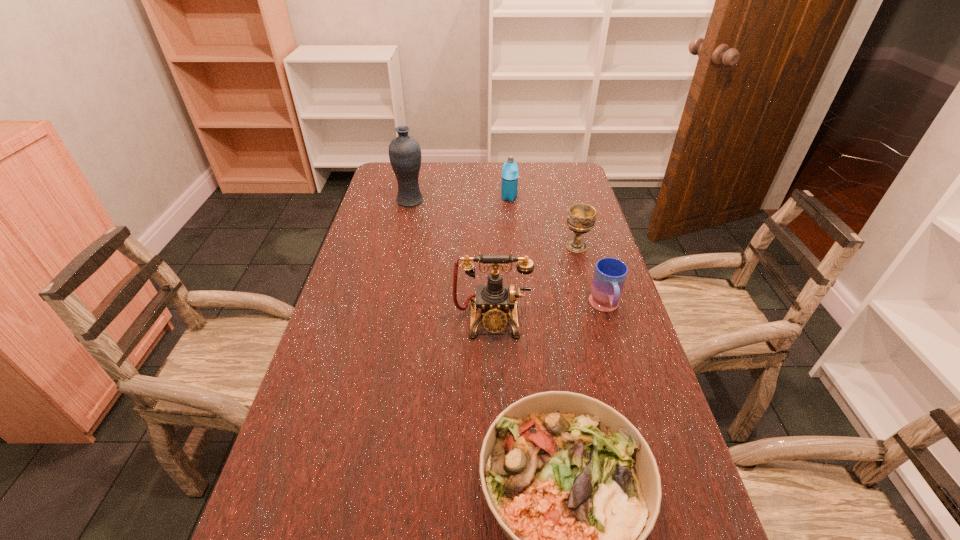
What are the coordinates of `vase` in the screenshot? It's located at (404, 151).

Locate an element on the screen. The image size is (960, 540). the tallest object is located at coordinates (404, 151).

Identify the location of the fifth shortest object. (494, 299).

Where is `thermos bottle`? Image resolution: width=960 pixels, height=540 pixels. thermos bottle is located at coordinates coord(509,185).

You are a GUI agent. You are given a task and a screenshot of the screen. Output one action in this format:
    pyautogui.click(x=<x>, y=<y>)
    Task: Click on the fourth nearest object
    The image size is (960, 540).
    Given the screenshot: What is the action you would take?
    pyautogui.click(x=581, y=218)

The image size is (960, 540). Identify the location of mug. (610, 274).

Identify the location of free region located 0.090m on the left of the vase. (371, 201).

Locate an element on the screen. vacant space located on the front of the fifth shortest object, featuring the rotary dial is located at coordinates (494, 422).

This screenshot has width=960, height=540. I want to click on free region located on the left of the thermos bottle, so click(422, 198).

This screenshot has width=960, height=540. I want to click on blank space located 0.300m on the left of the chalice, so click(x=468, y=247).